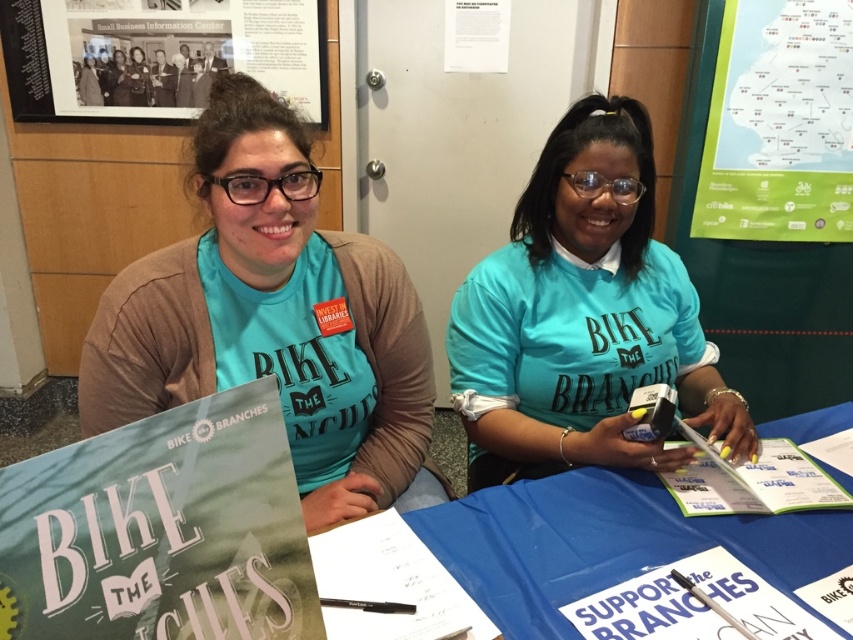
You are organizing a community event and need to display materials. You have the matte green poster at center and the black paper at upper left. Which one should you choose if you want the taller display item?

The black paper at upper left is taller than the matte green poster at center, so you should choose the black paper at upper left for the taller display item.